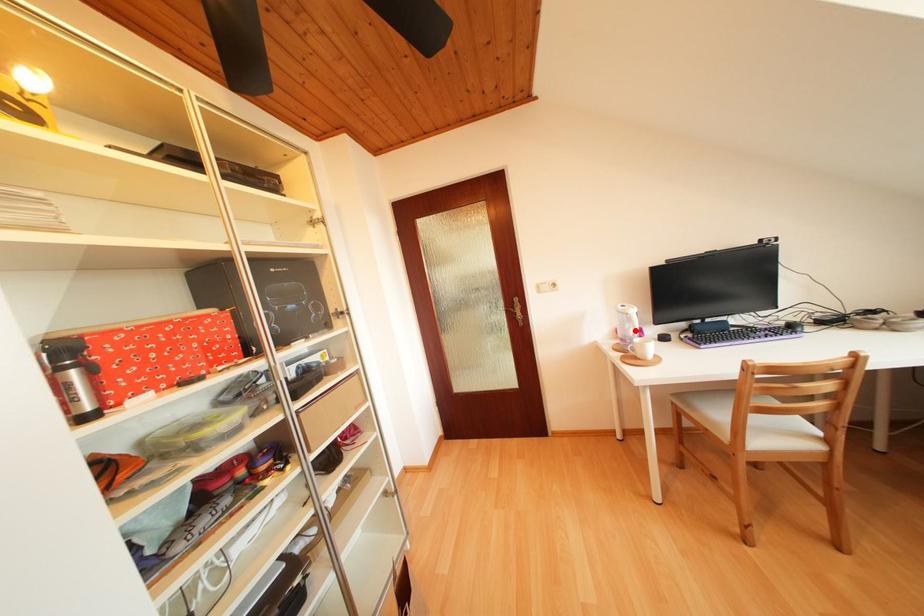
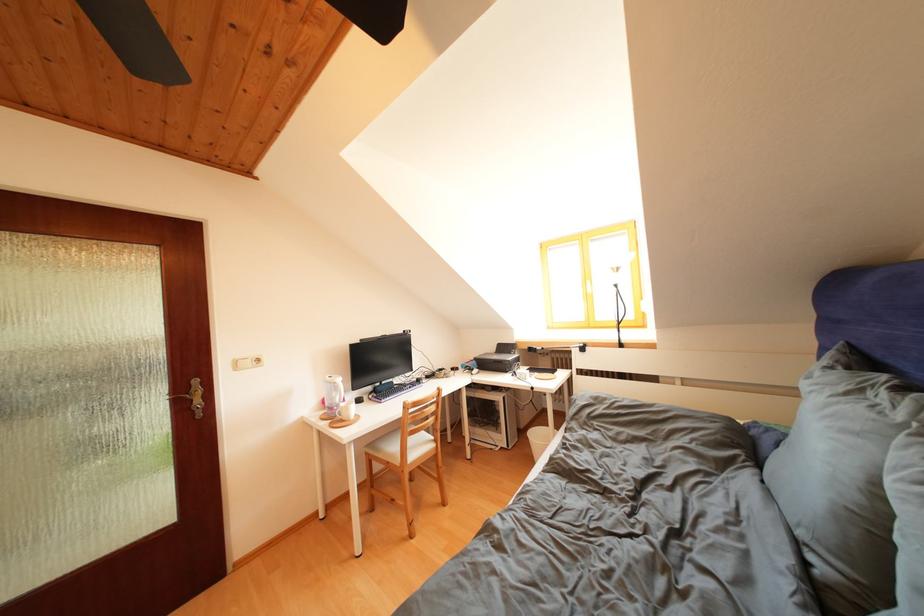
Question: I am providing you with two images of the same scene from different viewpoints. A red point is marked on the first image. Is the red point's position out of view in image 2?

Choices:
 (A) Yes
 (B) No

Answer: (B)